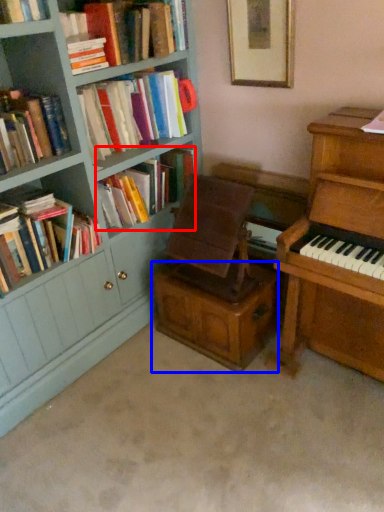
Question: Which object is closer to the camera taking this photo, book (highlighted by a red box) or drawer (highlighted by a blue box)?

Choices:
 (A) book
 (B) drawer

Answer: (B)